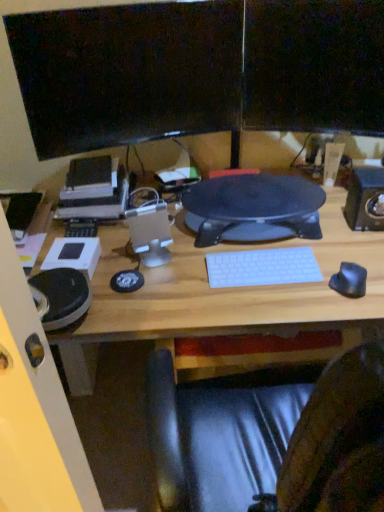
The image size is (384, 512). I want to click on empty space that is ontop of white plastic keyboard at center (from a real-world perspective), so click(259, 264).